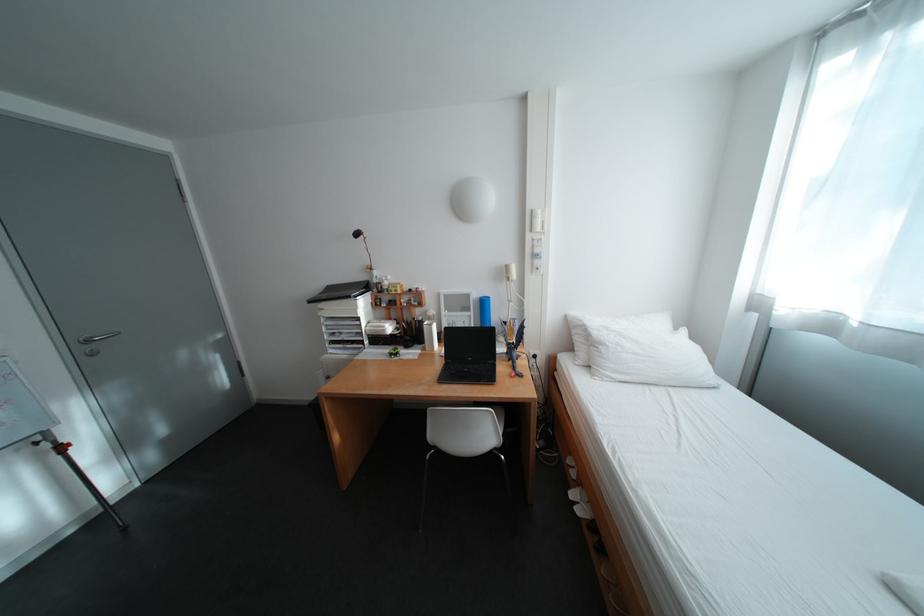
Find where to pull the silver door handle. Please return your answer as a coordinate pair (x, y).

(95, 341)